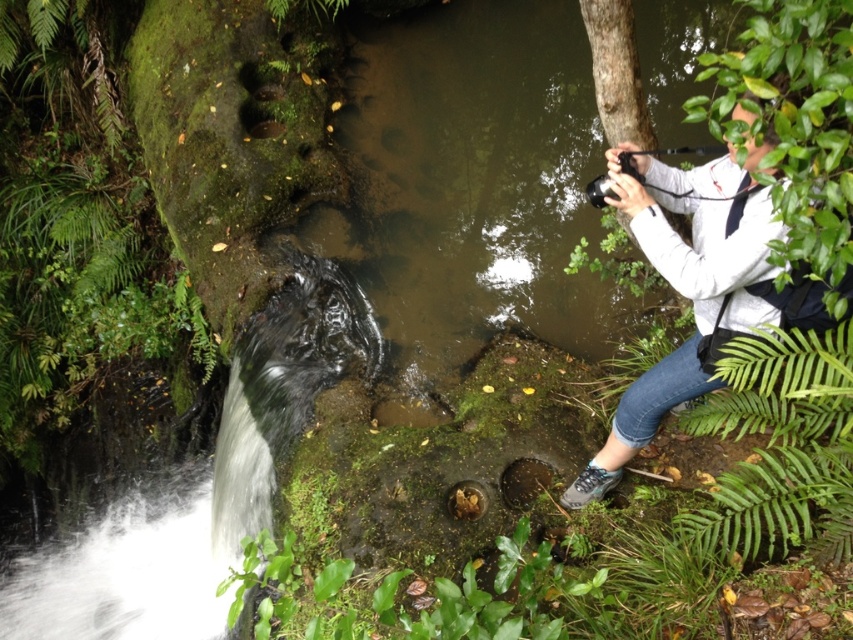
Question: Can you confirm if white fabric camera at upper right is wider than green leafy fern at lower right?

Choices:
 (A) no
 (B) yes

Answer: (B)

Question: Does white fabric camera at upper right lie behind green leafy fern at lower right?

Choices:
 (A) yes
 (B) no

Answer: (B)

Question: Which of the following is the closest to the observer?

Choices:
 (A) green leafy fern at lower right
 (B) white fabric camera at upper right

Answer: (B)

Question: Is white fabric camera at upper right wider than green leafy fern at lower right?

Choices:
 (A) yes
 (B) no

Answer: (A)

Question: Among these points, which one is farthest from the camera?

Choices:
 (A) (830, 396)
 (B) (705, 305)

Answer: (A)